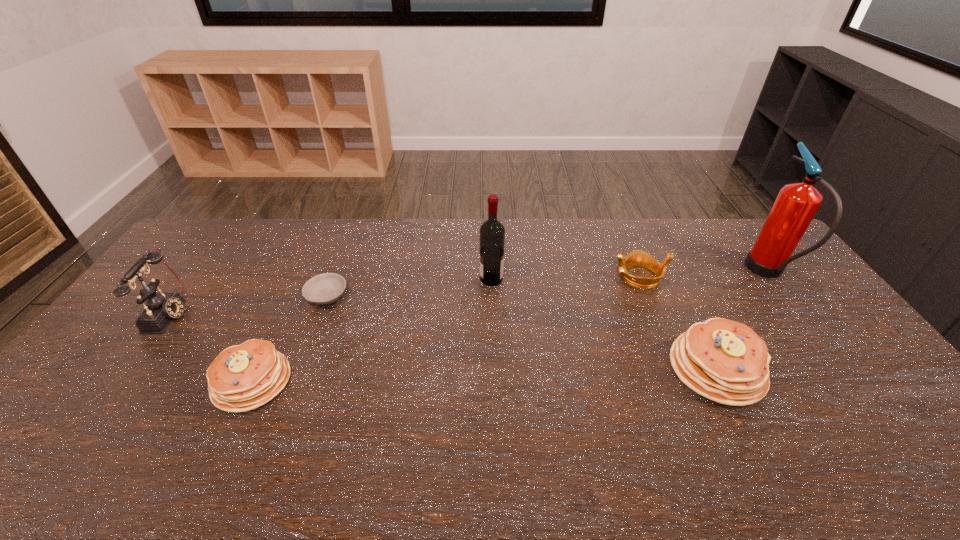
I want to click on vacant space that satisfies the following two spatial constraints: 1. on the front and back of the fourth object from right to left; 2. on the right side of the fourth tallest object, so click(494, 369).

Locate an element on the screen. The width and height of the screenshot is (960, 540). vacant space that satisfies the following two spatial constraints: 1. on the front and back of the fourth object from right to left; 2. on the right side of the taller pancake is located at coordinates (494, 369).

Where is `vacant area that satisfies the following two spatial constraints: 1. on the back side of the bowl; 2. on the right side of the rightmost object`? This screenshot has width=960, height=540. vacant area that satisfies the following two spatial constraints: 1. on the back side of the bowl; 2. on the right side of the rightmost object is located at coordinates (336, 273).

Identify the location of vacant space that satisfies the following two spatial constraints: 1. on the back side of the fire extinguisher; 2. on the left side of the bowl. (336, 273).

Where is `free location that satisfies the following two spatial constraints: 1. on the dial of the taller pancake; 2. on the left side of the telephone`? free location that satisfies the following two spatial constraints: 1. on the dial of the taller pancake; 2. on the left side of the telephone is located at coordinates (129, 369).